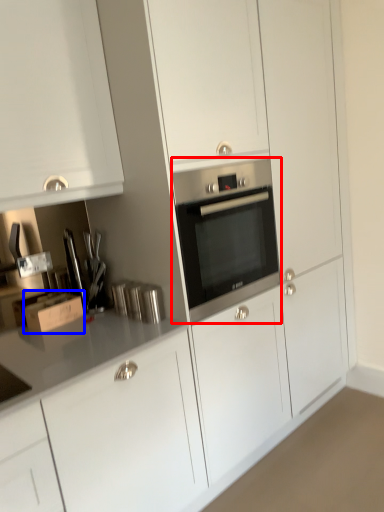
Question: Which object appears farthest to the camera in this image, home appliance (highlighted by a red box) or cardboard box (highlighted by a blue box)?

Choices:
 (A) home appliance
 (B) cardboard box

Answer: (B)